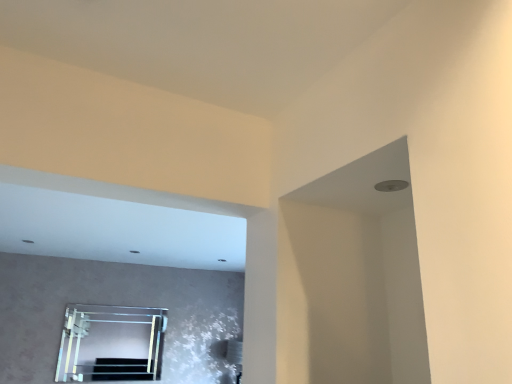
Find the location of `transparent glass window at lower left`. transparent glass window at lower left is located at coordinates (111, 343).

What do you see at coordinates (111, 343) in the screenshot? Image resolution: width=512 pixels, height=384 pixels. I see `transparent glass window at lower left` at bounding box center [111, 343].

In the scene shown: What is the approximate width of transparent glass window at lower left?

It is 2.62 inches.

At what (x,y) coordinates should I click in order to perform the action: click on transparent glass window at lower left. Please return your answer as a coordinate pair (x, y). This screenshot has height=384, width=512. Looking at the image, I should click on (111, 343).